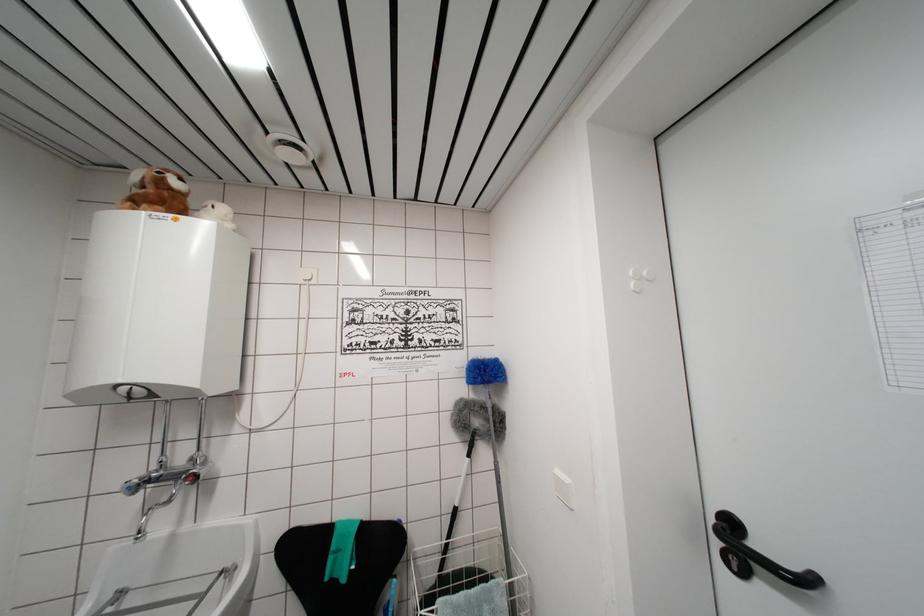
Find the location of `brown stuffed animal`. brown stuffed animal is located at coordinates (157, 192).